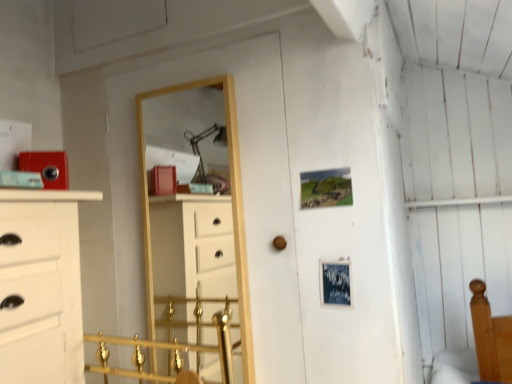
Question: Does brown matte door handle at center appear on the left side of gold wooden mirror at center?

Choices:
 (A) no
 (B) yes

Answer: (A)

Question: Can you confirm if brown matte door handle at center is taller than gold wooden mirror at center?

Choices:
 (A) no
 (B) yes

Answer: (A)

Question: Is brown matte door handle at center oriented towards gold wooden mirror at center?

Choices:
 (A) no
 (B) yes

Answer: (A)

Question: From the image's perspective, is brown matte door handle at center beneath gold wooden mirror at center?

Choices:
 (A) no
 (B) yes

Answer: (B)

Question: From a real-world perspective, is brown matte door handle at center physically above gold wooden mirror at center?

Choices:
 (A) yes
 (B) no

Answer: (B)

Question: Considering the relative sizes of brown matte door handle at center and gold wooden mirror at center in the image provided, is brown matte door handle at center wider than gold wooden mirror at center?

Choices:
 (A) no
 (B) yes

Answer: (A)

Question: Can you confirm if gold wooden mirror at center is bigger than brown matte door handle at center?

Choices:
 (A) yes
 (B) no

Answer: (A)

Question: From a real-world perspective, does gold wooden mirror at center stand above brown matte door handle at center?

Choices:
 (A) yes
 (B) no

Answer: (A)

Question: Does gold wooden mirror at center appear on the right side of brown matte door handle at center?

Choices:
 (A) yes
 (B) no

Answer: (B)

Question: Is gold wooden mirror at center facing away from brown matte door handle at center?

Choices:
 (A) yes
 (B) no

Answer: (B)

Question: Does gold wooden mirror at center come behind brown matte door handle at center?

Choices:
 (A) no
 (B) yes

Answer: (B)

Question: Can you confirm if gold wooden mirror at center is wider than brown matte door handle at center?

Choices:
 (A) no
 (B) yes

Answer: (B)

Question: In terms of size, does brown matte door handle at center appear bigger or smaller than gold wooden mirror at center?

Choices:
 (A) big
 (B) small

Answer: (B)